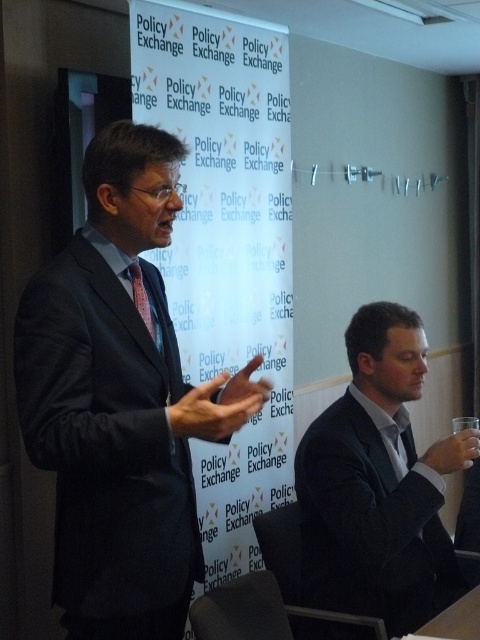
You are an event planner organizing a networking event and need to arrange seating for two key speakers. The dark gray suit at right and the pink silk tie at center are part of their attire. Based on their positions in the image, which speaker should you seat closer to the podium to ensure they can easily reference the banner behind them?

The dark gray suit at right should be seated closer to the podium because they are positioned under the pink silk tie at center, meaning they are closer to the banner behind them.

You are organizing a charity event and need to place a donation box between the dark gray suit at right and the pink silk tie at center. The box requires 1.2 meters of space. Can the available space accommodate it?

The dark gray suit at right is wider than the pink silk tie at center, but the description does not provide specific measurements for their widths. Therefore, it is uncertain if the available space between them can accommodate the 1.2 meter donation box.

You are an event planner trying to place a small podium for the speaker. The podium must be placed at the point with coordinates point (120, 401). According to the image, where exactly will the podium be placed?

The podium will be placed on the dark gray suit at center, as the point (120, 401) is located there.